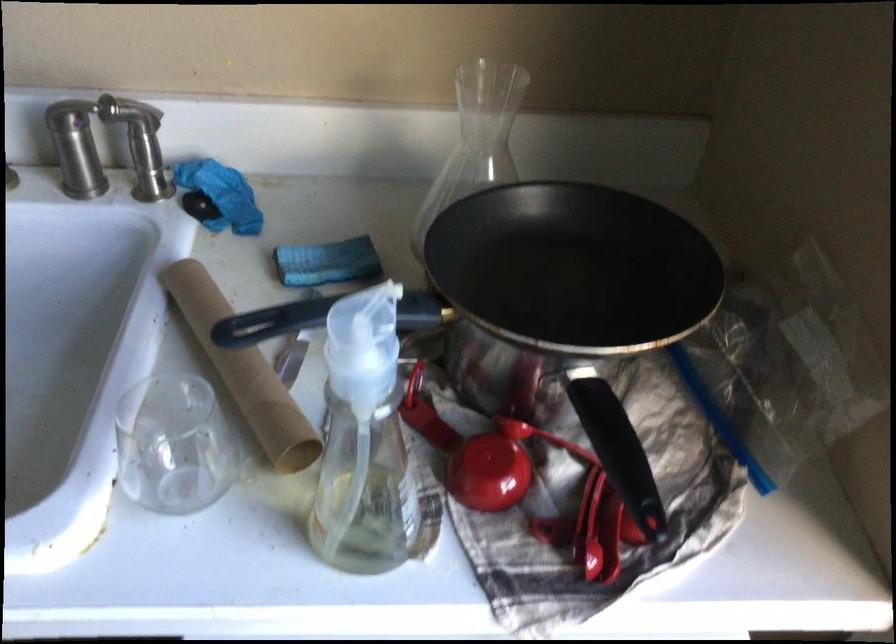
You are a GUI agent. You are given a task and a screenshot of the screen. Output one action in this format:
    pyautogui.click(x=<x>, y=<y>)
    Task: Click on the spray bottle pump
    This screenshot has height=644, width=896.
    Given the screenshot: What is the action you would take?
    pyautogui.click(x=383, y=451)